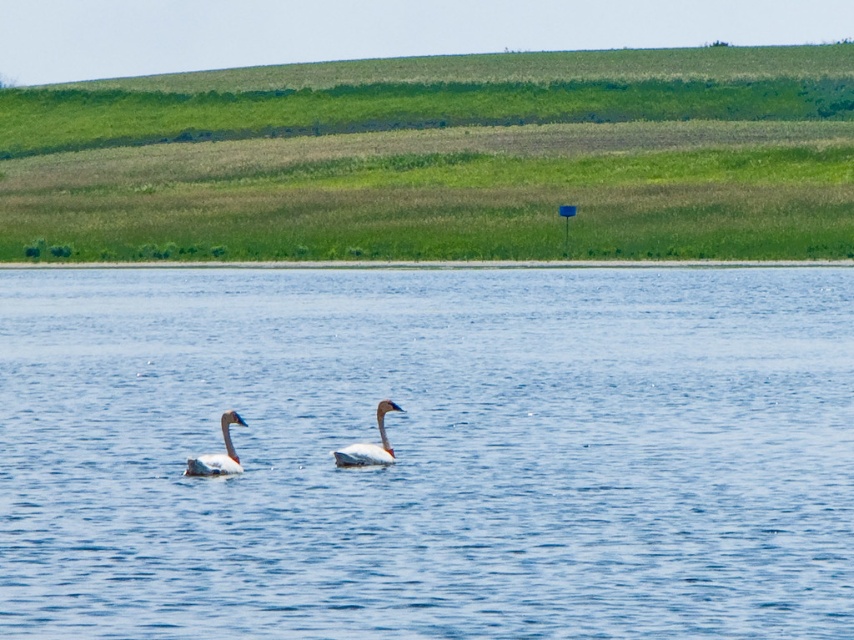
Question: Which object is the farthest from the blue water at center?

Choices:
 (A) white matte swan at left
 (B) green grassy hillside at upper center
 (C) white matte swan at center

Answer: (B)

Question: Which point appears farthest from the camera in this image?

Choices:
 (A) (349, 458)
 (B) (454, 177)
 (C) (563, 492)
 (D) (231, 452)

Answer: (B)

Question: Considering the real-world distances, which object is closest to the green grassy hillside at upper center?

Choices:
 (A) blue water at center
 (B) white matte swan at left

Answer: (A)

Question: Is green grassy hillside at upper center thinner than white matte swan at center?

Choices:
 (A) yes
 (B) no

Answer: (B)

Question: Does blue water at center appear under green grassy hillside at upper center?

Choices:
 (A) no
 (B) yes

Answer: (B)

Question: Is the position of green grassy hillside at upper center less distant than that of white matte swan at left?

Choices:
 (A) no
 (B) yes

Answer: (A)